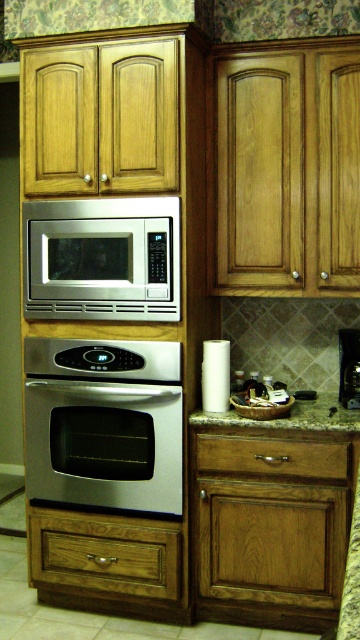
You are preparing to place a hot dish from the stainless steel microwave at center onto the granite countertop at lower center. Based on their positions, will the dish land safely on the countertop without needing to move it horizontally?

The stainless steel microwave at center is above the granite countertop at lower center, so placing the dish directly downward will land it safely on the countertop without needing to move it horizontally.

You are a kitchen designer planning to place a new appliance on the granite countertop at lower center. The appliance requires a minimum of 0.5 meters of clearance on all sides. Given the coordinates of the countertop, can you confirm if there is sufficient space around it for the appliance?

The granite countertop at lower center is located at point (290,417). Since the coordinates are provided, but the dimensions of the countertop and surrounding space are not specified, it is impossible to determine if there is sufficient clearance for the appliance. Additional measurements are needed to ensure proper placement.

You are taking a photo of the kitchen and want to focus on both point (312, 417) and point (353, 381). Which point should you adjust your focus to ensure both are in the clearest possible view?

Point (312, 417) is closer to the camera than point (353, 381). To ensure both are in focus, adjust the focus to the closer point, point (312, 417), and use a smaller aperture for a deeper depth of field.